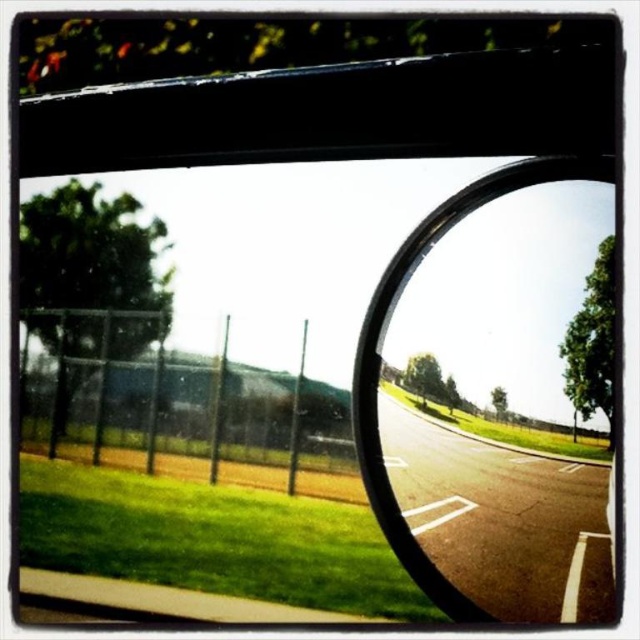
Question: Among these points, which one is farthest from the camera?

Choices:
 (A) (332, 440)
 (B) (449, 221)

Answer: (A)

Question: Is transparent glass car window at center thinner than black rubber car mirror at center?

Choices:
 (A) no
 (B) yes

Answer: (A)

Question: Can you confirm if transparent glass car window at center is bigger than black rubber car mirror at center?

Choices:
 (A) no
 (B) yes

Answer: (B)

Question: Which point is closer to the camera?

Choices:
 (A) transparent glass car window at center
 (B) black rubber car mirror at center

Answer: (A)

Question: Which object is closer to the camera taking this photo?

Choices:
 (A) black rubber car mirror at center
 (B) transparent glass car window at center

Answer: (B)

Question: In this image, where is transparent glass car window at center located relative to black rubber car mirror at center?

Choices:
 (A) right
 (B) left

Answer: (B)